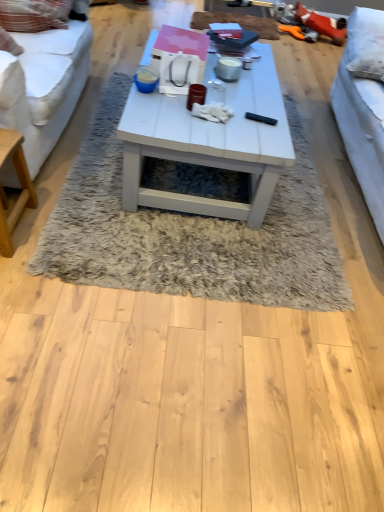
Locate an element on the screen. The image size is (384, 512). free point above white matte coffee table at center (from a real-world perspective) is located at coordinates (217, 98).